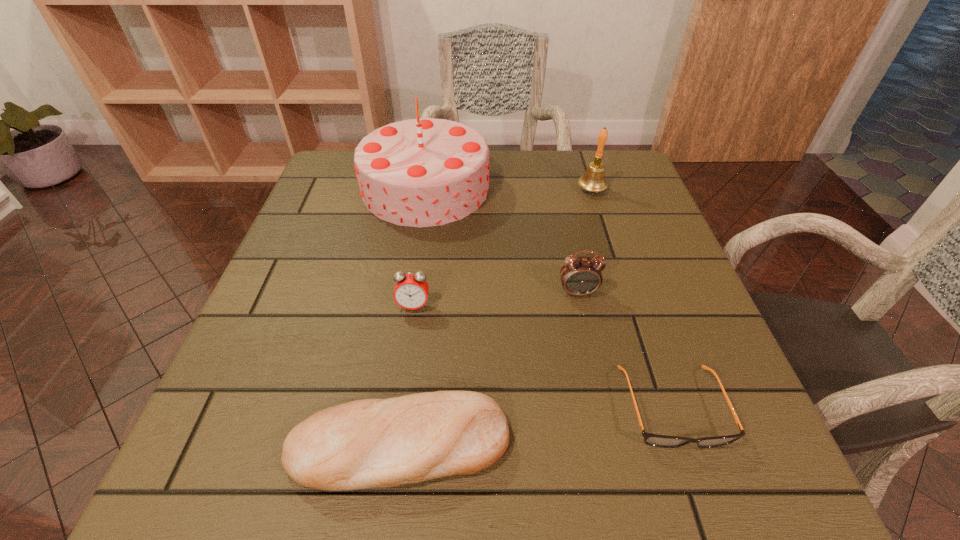
This screenshot has width=960, height=540. In order to click on the tallest object in this screenshot , I will do point(424,172).

Identify the location of the fifth shortest object. (x=593, y=180).

Image resolution: width=960 pixels, height=540 pixels. Identify the location of the third tallest object. (580, 276).

Where is `the taller alarm clock`? The height and width of the screenshot is (540, 960). the taller alarm clock is located at coordinates (580, 276).

You are a GUI agent. You are given a task and a screenshot of the screen. Output one action in this format:
    pyautogui.click(x=<x>, y=<y>)
    Task: Click on the shorter alarm clock
    The height and width of the screenshot is (540, 960).
    Given the screenshot: What is the action you would take?
    pyautogui.click(x=411, y=290)

Image resolution: width=960 pixels, height=540 pixels. Identify the location of bread. [371, 443].

The height and width of the screenshot is (540, 960). What are the coordinates of `the shortest object` in the screenshot? It's located at (655, 440).

I want to click on vacant space located 0.090m on the left of the birthday cake, so click(x=326, y=188).

Identify the location of free space located on the back of the second tallest object. (580, 153).

I want to click on free space located 0.120m on the face of the fourth shortest object, so click(x=590, y=349).